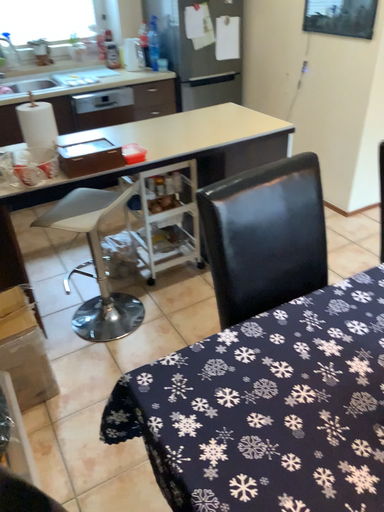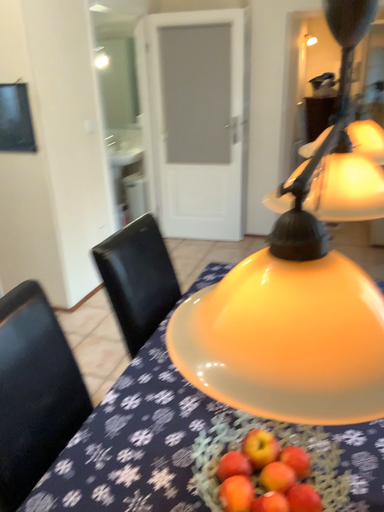
Question: Which way did the camera rotate in the video?

Choices:
 (A) rotated upward
 (B) rotated downward

Answer: (A)